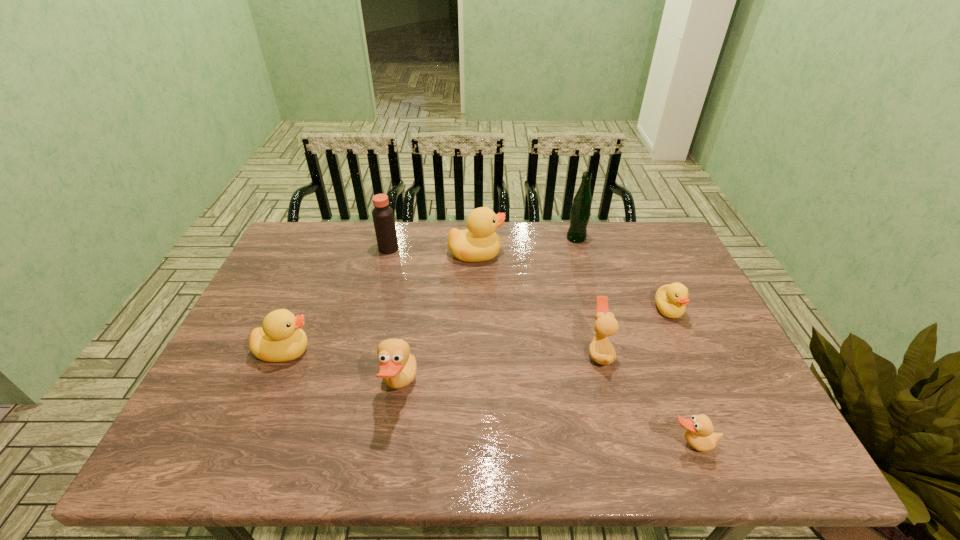
At what (x,y) coordinates should I click in order to perform the action: click on duck identified as the fifth closest to the smallest tan duck. Please return your answer as a coordinate pair (x, y). The width and height of the screenshot is (960, 540). Looking at the image, I should click on (280, 339).

Identify which yellow duck is the second nearest to the brown vinegar. Please provide its 2D coordinates. Your answer should be formatted as a tuple, i.e. [(x, y)], where the tuple contains the x and y coordinates of a point satisfying the conditions above.

[(280, 339)]

Identify the location of yellow duck that stands as the second closest to the farthest yellow duck. Image resolution: width=960 pixels, height=540 pixels. (671, 299).

Identify which tan duck is the third closest to the fifth nearest object. Please provide its 2D coordinates. Your answer should be formatted as a tuple, i.e. [(x, y)], where the tuple contains the x and y coordinates of a point satisfying the conditions above.

[(398, 368)]

This screenshot has width=960, height=540. I want to click on tan duck that is the closest one to the leftmost object, so click(x=398, y=368).

Locate an element on the screen. The height and width of the screenshot is (540, 960). free location that satisfies the following two spatial constraints: 1. on the front side of the green beer bottle; 2. at the beak of the second smallest yellow duck is located at coordinates (608, 351).

Identify the location of free point that satisfies the following two spatial constraints: 1. on the front side of the tallest object; 2. on the beak of the second tan duck from left to right. (608, 352).